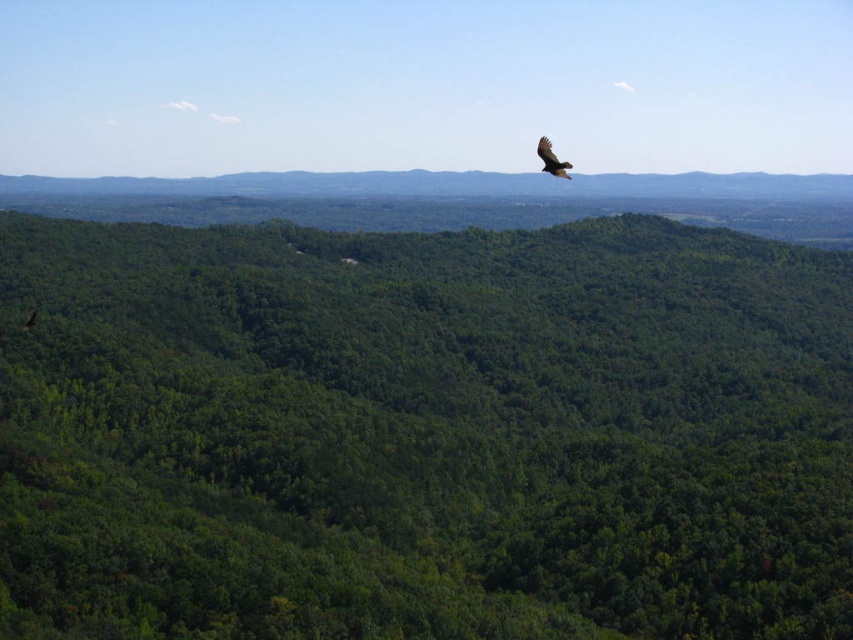
Question: Which object is closer to the camera taking this photo?

Choices:
 (A) dark brown feathers at upper center
 (B) green leafy forest at center

Answer: (A)

Question: Can you confirm if green leafy forest at center is positioned below dark brown feathers at upper center?

Choices:
 (A) yes
 (B) no

Answer: (A)

Question: Which point appears farthest from the camera in this image?

Choices:
 (A) (9, 372)
 (B) (544, 157)

Answer: (A)

Question: Is green leafy forest at center above dark brown feathers at upper center?

Choices:
 (A) yes
 (B) no

Answer: (B)

Question: Can you confirm if green leafy forest at center is positioned to the right of dark brown feathers at upper center?

Choices:
 (A) yes
 (B) no

Answer: (B)